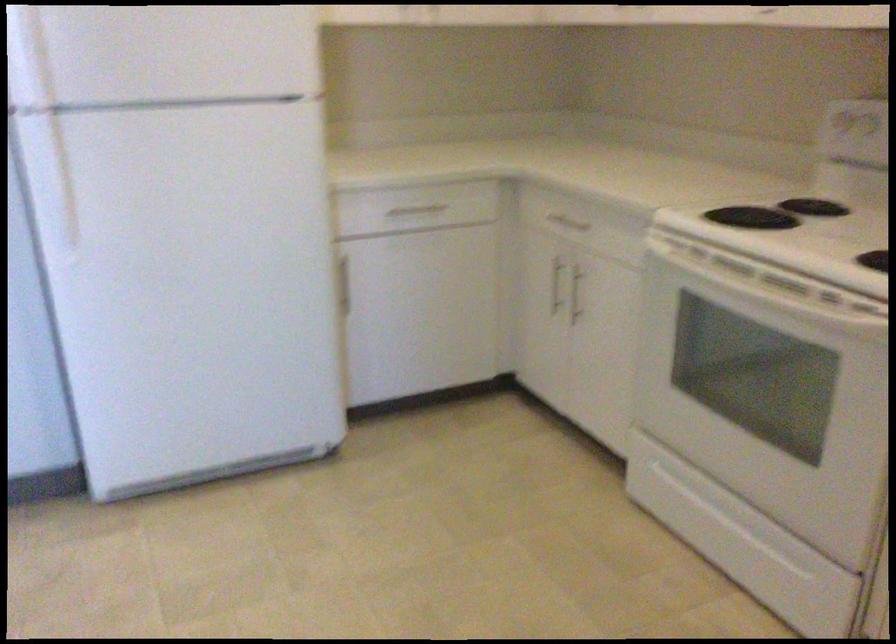
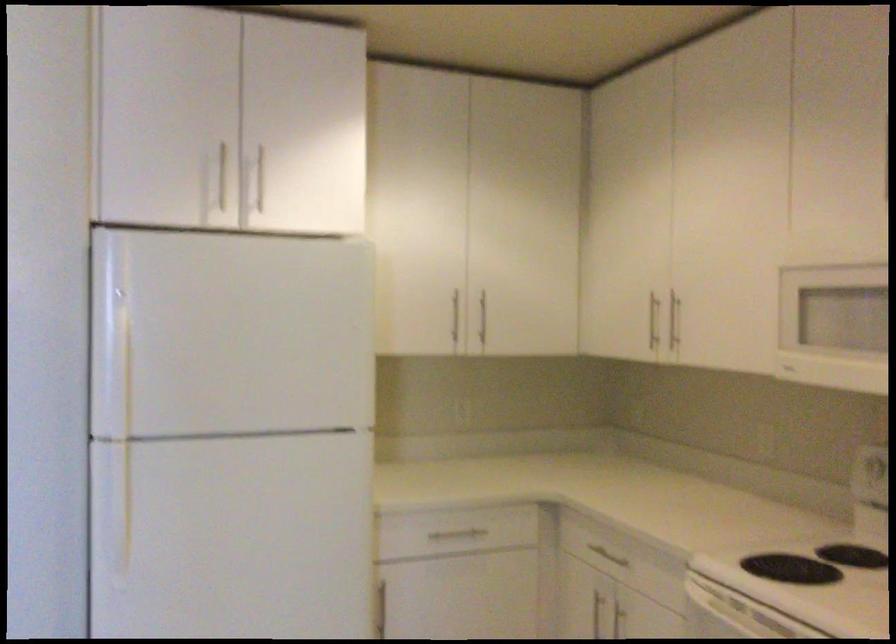
Question: Based on the continuous images, in which direction is the camera rotating? Reply with the corresponding letter.

Choices:
 (A) Left
 (B) Right
 (C) Up
 (D) Down

Answer: (C)